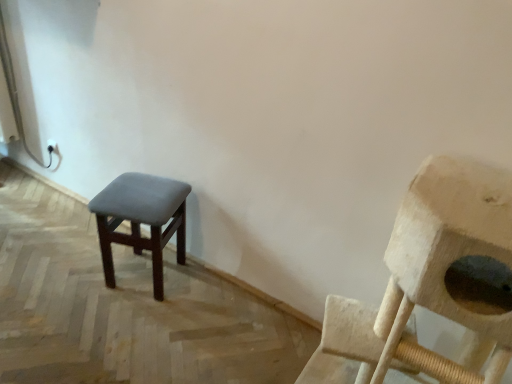
What are the coordinates of `vacant area situated below dark gray fabric stool at left (from a real-world perspective)` in the screenshot? It's located at (140, 277).